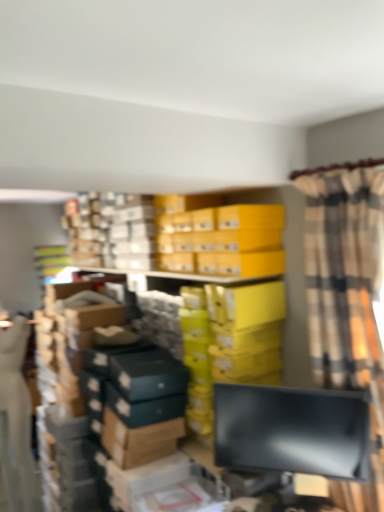
Question: Can you confirm if matte black monitor at lower right is positioned to the right of plaid fabric curtain at right?

Choices:
 (A) no
 (B) yes

Answer: (A)

Question: Does matte black monitor at lower right appear on the left side of plaid fabric curtain at right?

Choices:
 (A) no
 (B) yes

Answer: (B)

Question: From a real-world perspective, is matte black monitor at lower right on top of plaid fabric curtain at right?

Choices:
 (A) no
 (B) yes

Answer: (A)

Question: Does matte black monitor at lower right have a larger size compared to plaid fabric curtain at right?

Choices:
 (A) yes
 (B) no

Answer: (B)

Question: Can you confirm if matte black monitor at lower right is wider than plaid fabric curtain at right?

Choices:
 (A) yes
 (B) no

Answer: (B)

Question: In the image, is matte black monitor at lower right positioned in front of or behind yellow cardboard boxes at upper center?

Choices:
 (A) front
 (B) behind

Answer: (A)

Question: Is matte black monitor at lower right bigger or smaller than yellow cardboard boxes at upper center?

Choices:
 (A) small
 (B) big

Answer: (A)

Question: Is matte black monitor at lower right inside or outside of yellow cardboard boxes at upper center?

Choices:
 (A) inside
 (B) outside

Answer: (B)

Question: From a real-world perspective, is matte black monitor at lower right above or below yellow cardboard boxes at upper center?

Choices:
 (A) above
 (B) below

Answer: (B)

Question: From the image's perspective, is plaid fabric curtain at right located above or below yellow cardboard boxes at upper center?

Choices:
 (A) below
 (B) above

Answer: (A)

Question: Based on their positions, is plaid fabric curtain at right located to the left or right of yellow cardboard boxes at upper center?

Choices:
 (A) right
 (B) left

Answer: (A)

Question: From a real-world perspective, is plaid fabric curtain at right physically located above or below yellow cardboard boxes at upper center?

Choices:
 (A) above
 (B) below

Answer: (B)

Question: Considering the positions of plaid fabric curtain at right and yellow cardboard boxes at upper center in the image, is plaid fabric curtain at right bigger or smaller than yellow cardboard boxes at upper center?

Choices:
 (A) big
 (B) small

Answer: (A)

Question: Considering the positions of plaid fabric curtain at right and matte black monitor at lower right in the image, is plaid fabric curtain at right taller or shorter than matte black monitor at lower right?

Choices:
 (A) short
 (B) tall

Answer: (B)

Question: From the image's perspective, is plaid fabric curtain at right positioned above or below matte black monitor at lower right?

Choices:
 (A) above
 (B) below

Answer: (A)